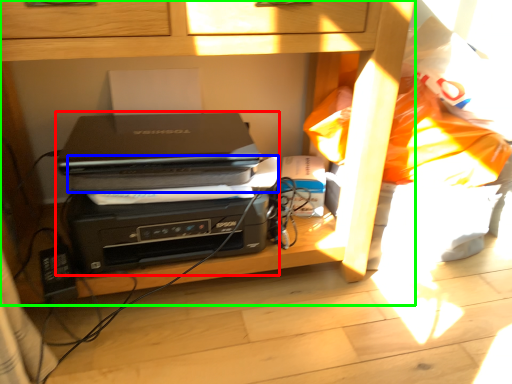
Question: Which object is the farthest from printer (highlighted by a red box)? Choose among these: paperback book (highlighted by a blue box) or furniture (highlighted by a green box).

Choices:
 (A) paperback book
 (B) furniture

Answer: (B)